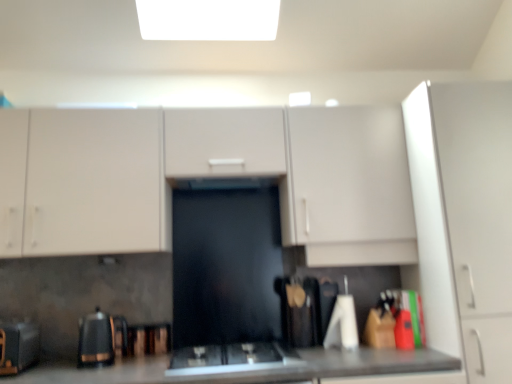
Describe the element at coordinates (305, 309) in the screenshot. I see `wooden spatula at center, the 3th appliance from the left` at that location.

What is the approximate height of white matte cabinet at right, positioned as the 1th cabinetry in right-to-left order?

The height of white matte cabinet at right, positioned as the 1th cabinetry in right-to-left order, is 1.53 meters.

The width and height of the screenshot is (512, 384). Identify the location of matte white cabinets at center, acting as the 1th cabinetry starting from the left. (204, 176).

From a real-world perspective, who is located higher, white matte cabinet at right, which is the second cabinetry from left to right, or wooden spatula at center, which ranks as the 1th appliance in right-to-left order?

white matte cabinet at right, which is the second cabinetry from left to right, from a real-world perspective.

Is white matte cabinet at right, which is the second cabinetry from left to right, turned away from wooden spatula at center, which ranks as the 1th appliance in right-to-left order?

That's not correct — white matte cabinet at right, which is the second cabinetry from left to right, is not looking away from wooden spatula at center, which ranks as the 1th appliance in right-to-left order.

From the image's perspective, relative to wooden spatula at center, the 3th appliance from the left, is white matte cabinet at right, positioned as the 1th cabinetry in right-to-left order, above or below?

Clearly, from the image's perspective, white matte cabinet at right, positioned as the 1th cabinetry in right-to-left order, is above wooden spatula at center, the 3th appliance from the left.

Is point (477, 298) positioned before point (327, 324)?

Yes.

Who is taller, black glossy kettle at lower left, the second appliance positioned from the left, or wooden spatula at center, which ranks as the 1th appliance in right-to-left order?

Standing taller between the two is wooden spatula at center, which ranks as the 1th appliance in right-to-left order.

From a real-world perspective, is black glossy kettle at lower left, the second appliance when ordered from right to left, physically above wooden spatula at center, which ranks as the 1th appliance in right-to-left order?

No, from a real-world perspective, black glossy kettle at lower left, the second appliance when ordered from right to left, is not on top of wooden spatula at center, which ranks as the 1th appliance in right-to-left order.

Considering the relative sizes of black glossy kettle at lower left, the second appliance positioned from the left, and wooden spatula at center, the 3th appliance from the left, in the image provided, is black glossy kettle at lower left, the second appliance positioned from the left, wider than wooden spatula at center, the 3th appliance from the left,?

No.

Considering the points (229, 142) and (301, 327), which point is behind, point (229, 142) or point (301, 327)?

The point (301, 327) is farther from the camera.

From a real-world perspective, starting from the matte white cabinets at center, acting as the 1th cabinetry starting from the left, which appliance is the 1st one below it? Please provide its 2D coordinates.

[(305, 309)]

Between matte white cabinets at center, acting as the 1th cabinetry starting from the left, and wooden spatula at center, the 3th appliance from the left, which one has smaller width?

Thinner between the two is wooden spatula at center, the 3th appliance from the left.

What are the coordinates of `the 1st cabinetry in front of the wooden spatula at center, which ranks as the 1th appliance in right-to-left order` in the screenshot? It's located at (204, 176).

Considering the sizes of objects wooden spatula at center, the 3th appliance from the left, and matte white cabinets at center, acting as the 1th cabinetry starting from the left, in the image provided, who is smaller, wooden spatula at center, the 3th appliance from the left, or matte white cabinets at center, acting as the 1th cabinetry starting from the left,?

Smaller between the two is wooden spatula at center, the 3th appliance from the left.

From the picture: Is there a large distance between wooden spatula at center, which ranks as the 1th appliance in right-to-left order, and matte white cabinets at center, the 2th cabinetry when ordered from right to left?

Actually, wooden spatula at center, which ranks as the 1th appliance in right-to-left order, and matte white cabinets at center, the 2th cabinetry when ordered from right to left, are a little close together.

Is wooden spatula at center, the 3th appliance from the left, in front of or behind matte white cabinets at center, acting as the 1th cabinetry starting from the left, in the image?

wooden spatula at center, the 3th appliance from the left, is behind matte white cabinets at center, acting as the 1th cabinetry starting from the left.

Is black glass gas stove at center oriented away from matte white cabinets at center, the 2th cabinetry when ordered from right to left?

No, black glass gas stove at center's orientation is not away from matte white cabinets at center, the 2th cabinetry when ordered from right to left.

Considering the relative sizes of black glass gas stove at center and matte white cabinets at center, the 2th cabinetry when ordered from right to left, in the image provided, is black glass gas stove at center smaller than matte white cabinets at center, the 2th cabinetry when ordered from right to left,?

Correct, black glass gas stove at center occupies less space than matte white cabinets at center, the 2th cabinetry when ordered from right to left.

Does black glass gas stove at center touch matte white cabinets at center, the 2th cabinetry when ordered from right to left?

No, black glass gas stove at center is not beside matte white cabinets at center, the 2th cabinetry when ordered from right to left.

Are black matte toaster at lower left, which is counted as the third appliance, starting from the right, and wooden spatula at center, which ranks as the 1th appliance in right-to-left order, beside each other?

No, black matte toaster at lower left, which is counted as the third appliance, starting from the right, is not beside wooden spatula at center, which ranks as the 1th appliance in right-to-left order.

From a real-world perspective, which is physically above, black matte toaster at lower left, which is the 1th appliance from left to right, or wooden spatula at center, which ranks as the 1th appliance in right-to-left order?

From a 3D spatial view, wooden spatula at center, which ranks as the 1th appliance in right-to-left order, is above.

Between black matte toaster at lower left, which is counted as the third appliance, starting from the right, and wooden spatula at center, the 3th appliance from the left, which one has more height?

With more height is wooden spatula at center, the 3th appliance from the left.

From the image's perspective, who appears lower, black matte toaster at lower left, which is the 1th appliance from left to right, or wooden spatula at center, which ranks as the 1th appliance in right-to-left order?

black matte toaster at lower left, which is the 1th appliance from left to right, is shown below in the image.

What's the angular difference between matte white cabinets at center, acting as the 1th cabinetry starting from the left, and black matte toaster at lower left, which is the 1th appliance from left to right,'s facing directions?

1.32 degrees separate the facing orientations of matte white cabinets at center, acting as the 1th cabinetry starting from the left, and black matte toaster at lower left, which is the 1th appliance from left to right.

Is matte white cabinets at center, the 2th cabinetry when ordered from right to left, oriented away from black matte toaster at lower left, which is counted as the third appliance, starting from the right?

No, matte white cabinets at center, the 2th cabinetry when ordered from right to left,'s orientation is not away from black matte toaster at lower left, which is counted as the third appliance, starting from the right.

Considering the positions of objects matte white cabinets at center, acting as the 1th cabinetry starting from the left, and black matte toaster at lower left, which is counted as the third appliance, starting from the right, in the image provided, who is more to the right, matte white cabinets at center, acting as the 1th cabinetry starting from the left, or black matte toaster at lower left, which is counted as the third appliance, starting from the right,?

matte white cabinets at center, acting as the 1th cabinetry starting from the left.

Consider the image. From the image's perspective, is matte white cabinets at center, acting as the 1th cabinetry starting from the left, located above or below black matte toaster at lower left, which is counted as the third appliance, starting from the right?

Answer: Clearly, from the image's perspective, matte white cabinets at center, acting as the 1th cabinetry starting from the left, is above black matte toaster at lower left, which is counted as the third appliance, starting from the right.

From a real-world perspective, count 1st appliances downward from the white matte cabinet at right, positioned as the 1th cabinetry in right-to-left order, and point to it. Please provide its 2D coordinates.

[(305, 309)]

Where is `appliance to the right of black glossy kettle at lower left, the second appliance positioned from the left`? This screenshot has width=512, height=384. appliance to the right of black glossy kettle at lower left, the second appliance positioned from the left is located at coordinates (305, 309).

Estimate the real-world distances between objects in this image. Which object is closer to black glossy kettle at lower left, the second appliance when ordered from right to left, matte white cabinets at center, acting as the 1th cabinetry starting from the left, or wooden spatula at center, the 3th appliance from the left?

Based on the image, matte white cabinets at center, acting as the 1th cabinetry starting from the left, appears to be nearer to black glossy kettle at lower left, the second appliance when ordered from right to left.

Which object lies nearer to the anchor point wooden spatula at center, the 3th appliance from the left, white matte cabinet at right, positioned as the 1th cabinetry in right-to-left order, or black glass gas stove at center?

black glass gas stove at center.

Considering their positions, is matte white cabinets at center, acting as the 1th cabinetry starting from the left, positioned further to wooden spatula at center, which ranks as the 1th appliance in right-to-left order, than black matte toaster at lower left, which is the 1th appliance from left to right?

Based on the image, black matte toaster at lower left, which is the 1th appliance from left to right, appears to be further to wooden spatula at center, which ranks as the 1th appliance in right-to-left order.

From the image, which object appears to be nearer to black matte toaster at lower left, which is counted as the third appliance, starting from the right, wooden spatula at center, which ranks as the 1th appliance in right-to-left order, or black glossy kettle at lower left, the second appliance when ordered from right to left?

black glossy kettle at lower left, the second appliance when ordered from right to left, is positioned closer to the anchor black matte toaster at lower left, which is counted as the third appliance, starting from the right.

In the scene shown: From the image, which object appears to be farther from black glossy kettle at lower left, the second appliance when ordered from right to left, black matte toaster at lower left, which is counted as the third appliance, starting from the right, or wooden spatula at center, which ranks as the 1th appliance in right-to-left order?

Among the two, wooden spatula at center, which ranks as the 1th appliance in right-to-left order, is located further to black glossy kettle at lower left, the second appliance when ordered from right to left.

Based on their spatial positions, is black glass gas stove at center or white matte cabinet at right, which is the second cabinetry from left to right, closer to black glossy kettle at lower left, the second appliance positioned from the left?

black glass gas stove at center.

Consider the image. Looking at the image, which one is located further to black matte toaster at lower left, which is counted as the third appliance, starting from the right, black glass gas stove at center or white matte cabinet at right, which is the second cabinetry from left to right?

Among the two, white matte cabinet at right, which is the second cabinetry from left to right, is located further to black matte toaster at lower left, which is counted as the third appliance, starting from the right.

Considering their positions, is black matte toaster at lower left, which is counted as the third appliance, starting from the right, positioned closer to matte white cabinets at center, the 2th cabinetry when ordered from right to left, than black glossy kettle at lower left, the second appliance positioned from the left?

Among the two, black glossy kettle at lower left, the second appliance positioned from the left, is located nearer to matte white cabinets at center, the 2th cabinetry when ordered from right to left.

The image size is (512, 384). I want to click on appliance located between matte white cabinets at center, acting as the 1th cabinetry starting from the left, and white matte cabinet at right, positioned as the 1th cabinetry in right-to-left order, in the left-right direction, so click(305, 309).

Where is `appliance between black matte toaster at lower left, which is the 1th appliance from left to right, and wooden spatula at center, which ranks as the 1th appliance in right-to-left order`? appliance between black matte toaster at lower left, which is the 1th appliance from left to right, and wooden spatula at center, which ranks as the 1th appliance in right-to-left order is located at coordinates (100, 339).

Where is `cabinetry located between black matte toaster at lower left, which is counted as the third appliance, starting from the right, and wooden spatula at center, which ranks as the 1th appliance in right-to-left order, in the left-right direction`? The height and width of the screenshot is (384, 512). cabinetry located between black matte toaster at lower left, which is counted as the third appliance, starting from the right, and wooden spatula at center, which ranks as the 1th appliance in right-to-left order, in the left-right direction is located at coordinates (x=204, y=176).

At what (x,y) coordinates should I click in order to perform the action: click on gas stove located between matte white cabinets at center, acting as the 1th cabinetry starting from the left, and white matte cabinet at right, positioned as the 1th cabinetry in right-to-left order, in the left-right direction. Please return your answer as a coordinate pair (x, y). The height and width of the screenshot is (384, 512). Looking at the image, I should click on (231, 358).